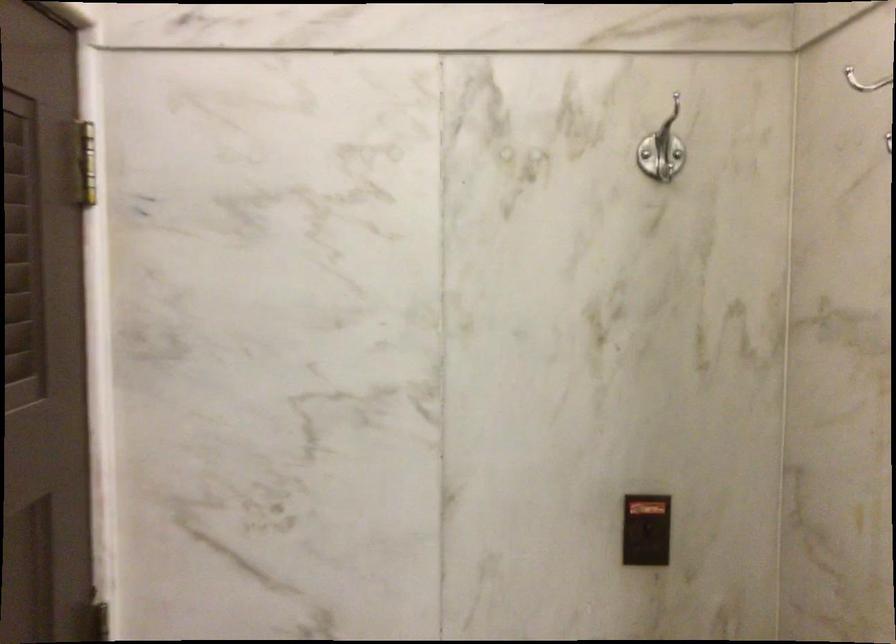
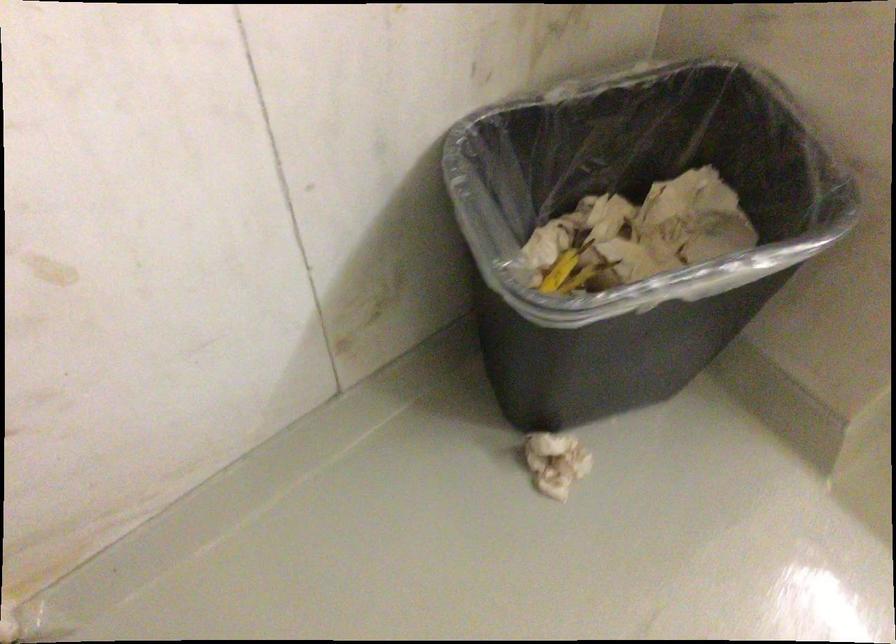
The images are taken continuously from a first-person perspective. In which direction is your viewpoint rotating?

The camera rotated toward right-down.